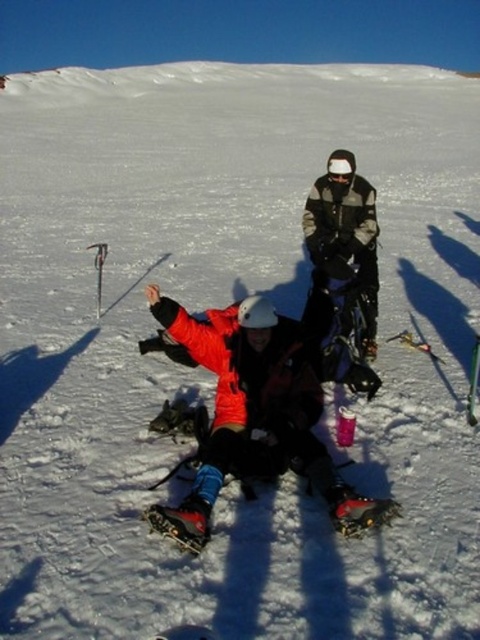
Question: Which object is farther from the camera taking this photo?

Choices:
 (A) metallic ski at center
 (B) matte red jacket at center
 (C) gray fleece jacket at upper center
 (D) red rubber snowshoe at lower center

Answer: (A)

Question: Among these points, which one is farthest from the camera?

Choices:
 (A) 202,520
 (B) 335,220
 (C) 351,508

Answer: (B)

Question: Does red plastic snowshoe at lower left lie behind metallic ski at center?

Choices:
 (A) yes
 (B) no

Answer: (B)

Question: Can you confirm if gray fleece jacket at upper center is positioned above red rubber snowshoe at lower center?

Choices:
 (A) yes
 (B) no

Answer: (A)

Question: Which point is farther from the camera taking this photo?

Choices:
 (A) (155, 513)
 (B) (406, 333)

Answer: (B)

Question: Does gray fleece jacket at upper center lie in front of red plastic snowshoe at lower left?

Choices:
 (A) yes
 (B) no

Answer: (B)